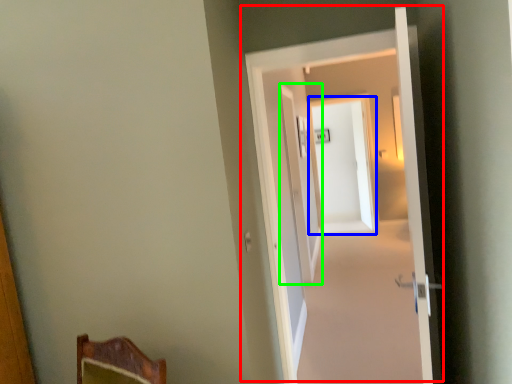
Question: Based on their relative distances, which object is nearer to door (highlighted by a red box)? Choose from screen door (highlighted by a blue box) and screen door (highlighted by a green box).

Choices:
 (A) screen door
 (B) screen door

Answer: (B)